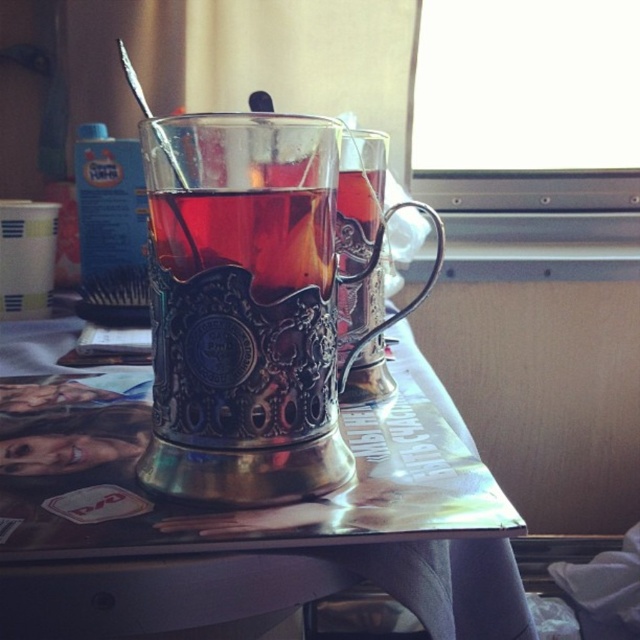
Question: Among these objects, which one is farthest from the camera?

Choices:
 (A) shiny metallic mug at center
 (B) metallic brass table at center

Answer: (A)

Question: Can you confirm if shiny metallic mug at center is thinner than metallic brass table at center?

Choices:
 (A) yes
 (B) no

Answer: (A)

Question: Which object appears farthest from the camera in this image?

Choices:
 (A) shiny metallic mug at center
 (B) metallic brass table at center

Answer: (A)

Question: Does shiny metallic mug at center appear on the right side of metallic brass table at center?

Choices:
 (A) yes
 (B) no

Answer: (B)

Question: In this image, where is shiny metallic mug at center located relative to metallic brass table at center?

Choices:
 (A) right
 (B) left

Answer: (B)